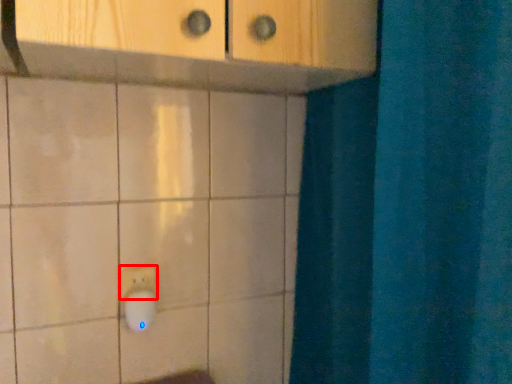
Question: Observing the image, what is the correct spatial positioning of light switch (annotated by the red box) in reference to knob?

Choices:
 (A) left
 (B) right

Answer: (A)